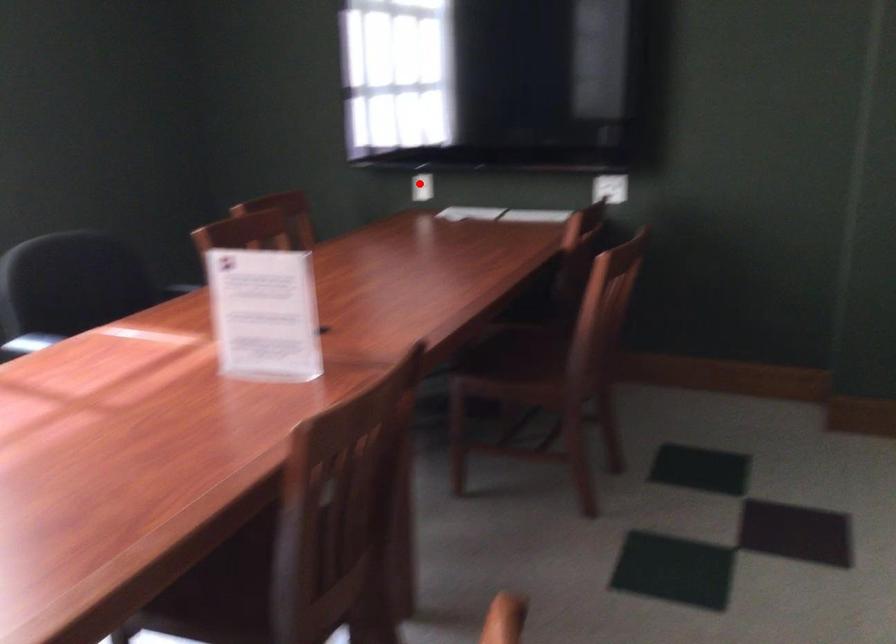
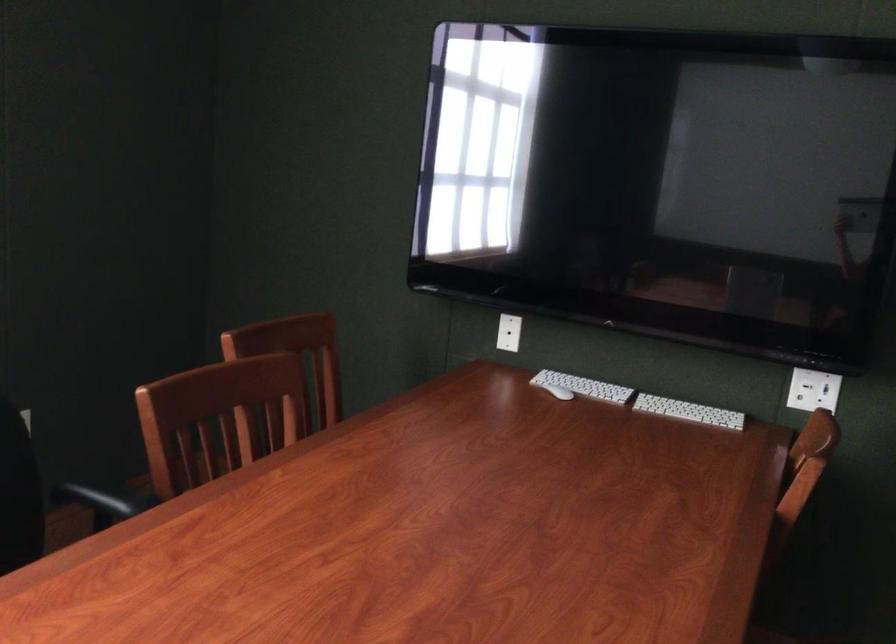
Locate, in the second image, the point that corresponds to the highlighted location in the first image.

(509, 333)